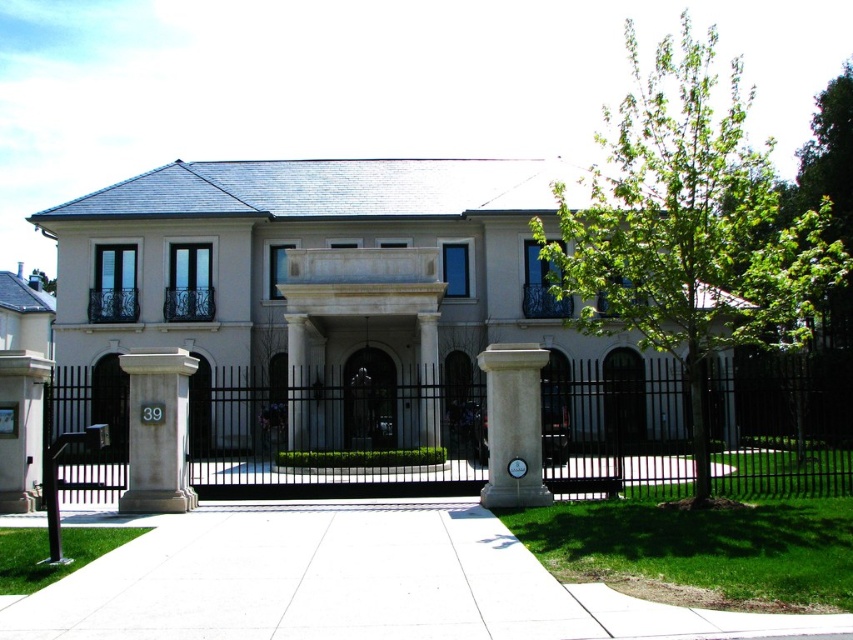
Question: Is black metal fence at center thinner than white stone pillar at center?

Choices:
 (A) no
 (B) yes

Answer: (A)

Question: Which of the following is the farthest from the observer?

Choices:
 (A) (601, 216)
 (B) (531, 492)

Answer: (A)

Question: Can you confirm if black metal fence at center is positioned to the right of white stone pillar at center?

Choices:
 (A) no
 (B) yes

Answer: (B)

Question: Which object is positioned farthest from the green leafy tree at upper right?

Choices:
 (A) beige stone mansion at center
 (B) white stone column at center
 (C) white concrete pavement at center
 (D) black metal fence at center

Answer: (C)

Question: Is the position of beige stone mansion at center less distant than that of black metal fence at center?

Choices:
 (A) no
 (B) yes

Answer: (A)

Question: Which object is closer to the camera taking this photo?

Choices:
 (A) white concrete pavement at center
 (B) black metal fence at center

Answer: (A)